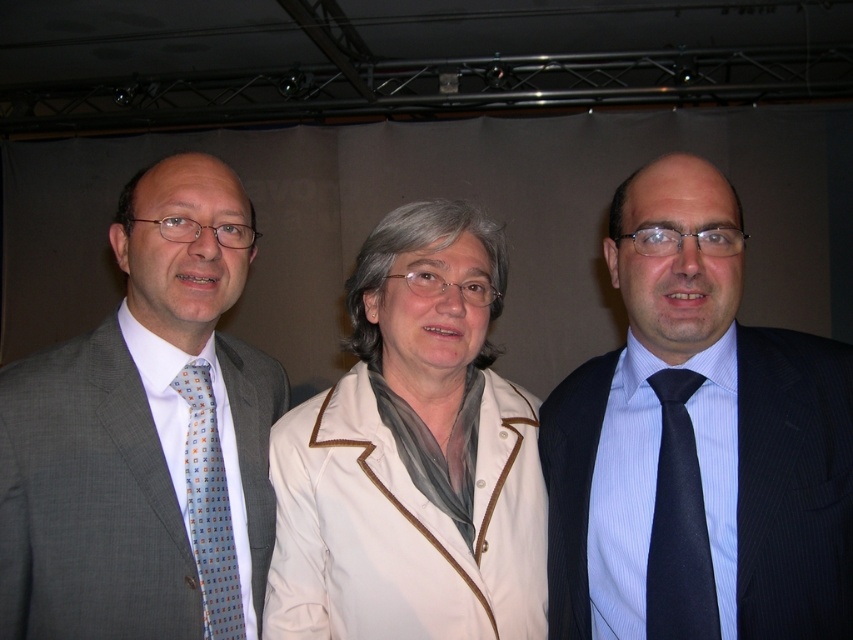
Question: Is white fabric coat at center positioned before dark blue silk tie at right?

Choices:
 (A) yes
 (B) no

Answer: (B)

Question: Which of the following is the farthest from the observer?

Choices:
 (A) dark blue pinstripe suit at right
 (B) dark blue silk tie at right
 (C) gray textured suit at left

Answer: (C)

Question: Which point is farther from the camera taking this photo?

Choices:
 (A) click(x=247, y=385)
 (B) click(x=625, y=621)
 (C) click(x=701, y=580)
 (D) click(x=187, y=368)

Answer: (A)

Question: Can you confirm if gray textured suit at left is wider than dark blue silk tie at right?

Choices:
 (A) no
 (B) yes

Answer: (B)

Question: Does gray textured suit at left have a lesser width compared to light blue printed tie at left?

Choices:
 (A) yes
 (B) no

Answer: (B)

Question: Which object is closer to the camera taking this photo?

Choices:
 (A) dark blue silk tie at right
 (B) light blue printed tie at left

Answer: (A)